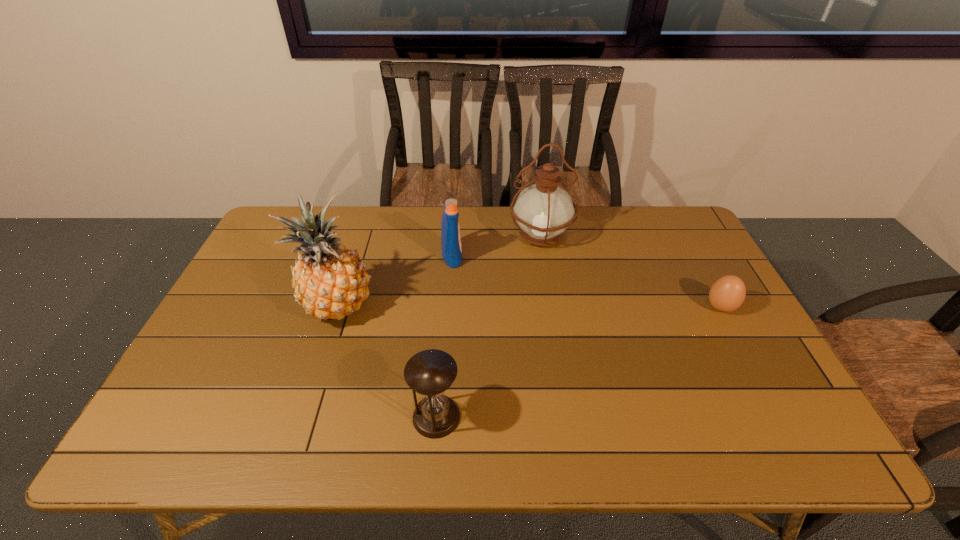
Where is `vacant space that is in between the pineapple and the second object from right to left`? The height and width of the screenshot is (540, 960). vacant space that is in between the pineapple and the second object from right to left is located at coordinates (439, 271).

The width and height of the screenshot is (960, 540). Identify the location of object that is the closest to the rightmost object. (543, 211).

At what (x,y) coordinates should I click in order to perform the action: click on object that is the nearest to the third shortest object. Please return your answer as a coordinate pair (x, y). The height and width of the screenshot is (540, 960). Looking at the image, I should click on (543, 211).

The image size is (960, 540). In order to click on vacant point that satisfies the following two spatial constraints: 1. on the label of the third shortest object; 2. on the front side of the second shortest object in this screenshot , I will do `click(441, 416)`.

Where is `vacant region that satisfies the following two spatial constraints: 1. on the back side of the boiled egg; 2. on the right side of the hourglass`? This screenshot has height=540, width=960. vacant region that satisfies the following two spatial constraints: 1. on the back side of the boiled egg; 2. on the right side of the hourglass is located at coordinates (445, 307).

Find the location of `vacant region that satisfies the following two spatial constraints: 1. on the label of the boiled egg; 2. on the right side of the detergent`. vacant region that satisfies the following two spatial constraints: 1. on the label of the boiled egg; 2. on the right side of the detergent is located at coordinates (448, 307).

Where is `free space that satisfies the following two spatial constraints: 1. on the back side of the oil lamp; 2. on the left side of the nearest object`? Image resolution: width=960 pixels, height=540 pixels. free space that satisfies the following two spatial constraints: 1. on the back side of the oil lamp; 2. on the left side of the nearest object is located at coordinates (450, 235).

Image resolution: width=960 pixels, height=540 pixels. Identify the location of blank space that satisfies the following two spatial constraints: 1. on the label of the detergent; 2. on the front side of the pineapple. (448, 306).

Locate an element on the screen. The image size is (960, 540). free spot that satisfies the following two spatial constraints: 1. on the back side of the boiled egg; 2. on the label of the detergent is located at coordinates (692, 256).

Locate an element on the screen. free space that satisfies the following two spatial constraints: 1. on the back side of the pineapple; 2. on the right side of the oil lamp is located at coordinates (360, 235).